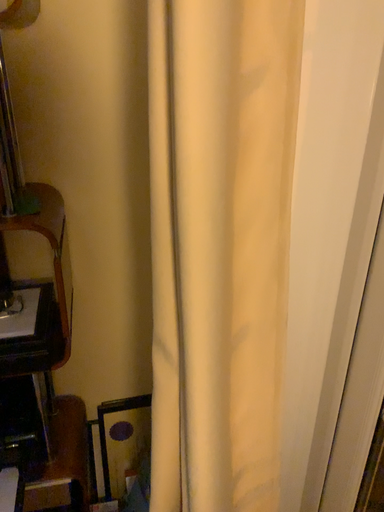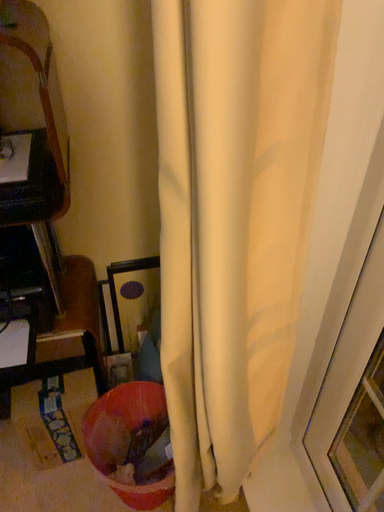
Question: How did the camera likely rotate when shooting the video?

Choices:
 (A) rotated downward
 (B) rotated upward

Answer: (A)